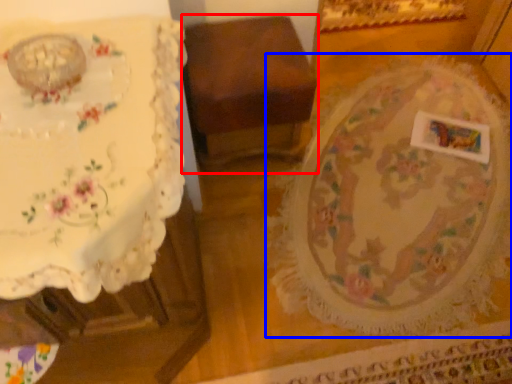
Question: Which object appears farthest to the camera in this image, furniture (highlighted by a red box) or round table (highlighted by a blue box)?

Choices:
 (A) furniture
 (B) round table

Answer: (A)